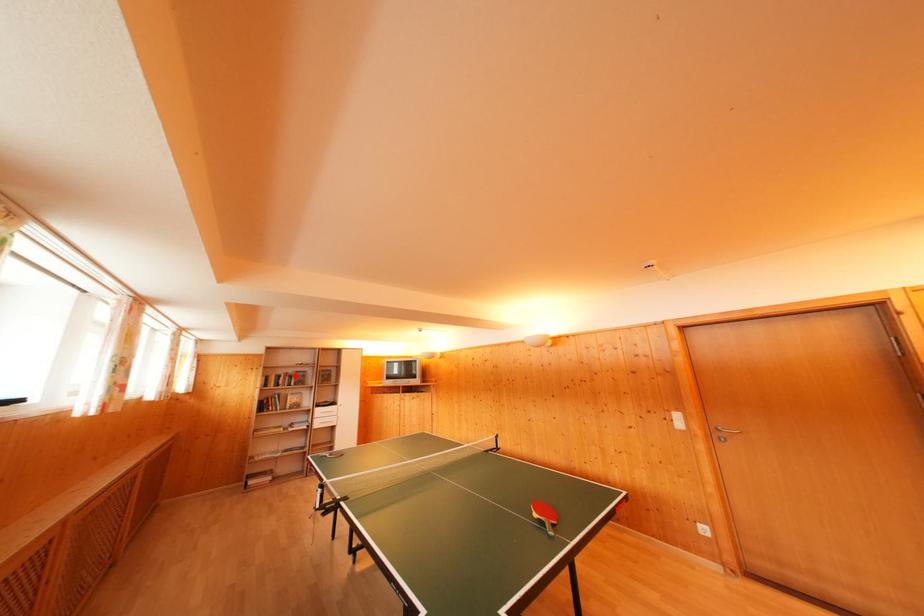
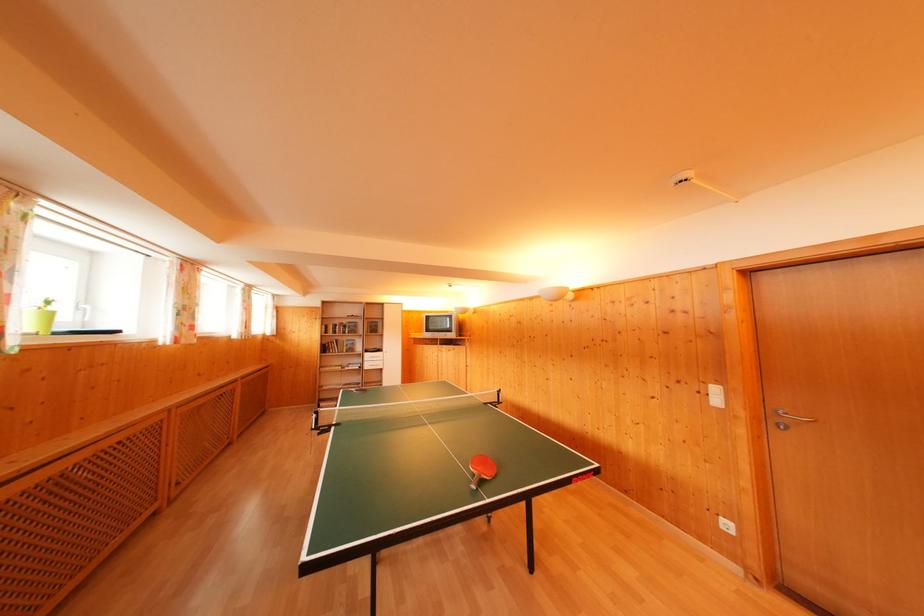
Locate, in the second image, the point that corresponds to the highlighted location in the first image.

(349, 326)